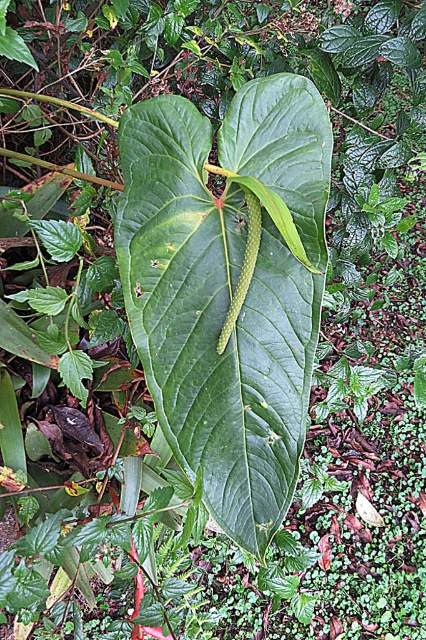
Question: Does green matte leaf at center have a lesser width compared to green smooth caterpillar at center?

Choices:
 (A) yes
 (B) no

Answer: (B)

Question: Which point is farther to the camera?

Choices:
 (A) green matte leaf at center
 (B) green smooth caterpillar at center

Answer: (B)

Question: Is green matte leaf at center below green smooth caterpillar at center?

Choices:
 (A) no
 (B) yes

Answer: (B)

Question: Which object appears closest to the camera in this image?

Choices:
 (A) green smooth caterpillar at center
 (B) green matte leaf at center

Answer: (B)

Question: Is green matte leaf at center to the left of green smooth caterpillar at center from the viewer's perspective?

Choices:
 (A) no
 (B) yes

Answer: (B)